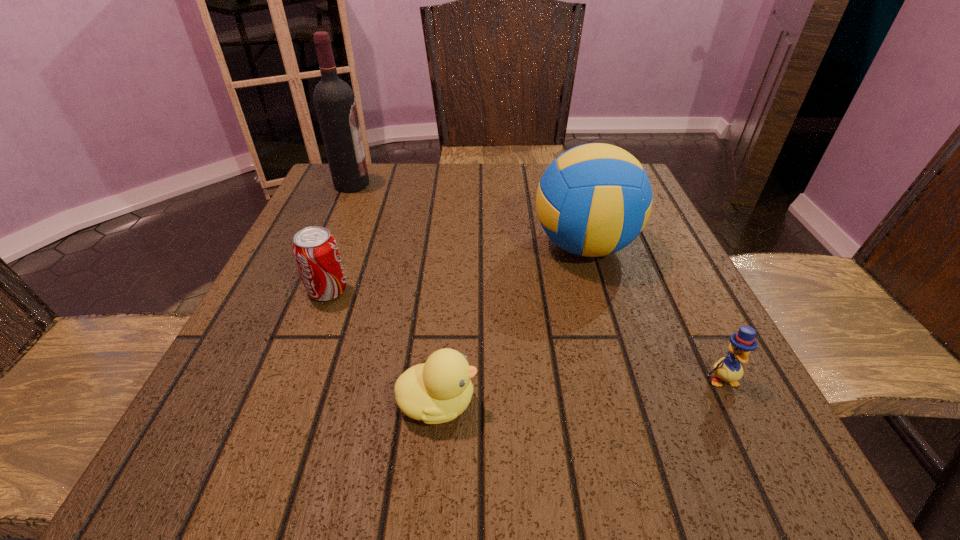
Identify the location of vacant space at the left edge. (303, 227).

You are a GUI agent. You are given a task and a screenshot of the screen. Output one action in this format:
    pyautogui.click(x=<x>, y=<y>)
    Task: Click on the vacant area at the far left corner
    The width and height of the screenshot is (960, 540).
    Given the screenshot: What is the action you would take?
    pyautogui.click(x=321, y=188)

Identify the location of vacant space at the near left corner. The image size is (960, 540). (226, 443).

The height and width of the screenshot is (540, 960). I want to click on free region at the near right corner, so click(681, 446).

At what (x,y) coordinates should I click in order to perform the action: click on free point between the left duckling and the right duckling. Please return your answer as a coordinate pair (x, y). Looking at the image, I should click on 580,391.

Where is `free space that is in between the fourth shortest object and the right duckling`? This screenshot has height=540, width=960. free space that is in between the fourth shortest object and the right duckling is located at coordinates (653, 313).

Locate an element on the screen. This screenshot has height=540, width=960. free space between the third object from left to right and the rightmost object is located at coordinates (580, 391).

The image size is (960, 540). Identify the location of free space between the right duckling and the second object from right to left. (653, 313).

The image size is (960, 540). I want to click on blank region between the left duckling and the rightmost object, so click(580, 391).

The width and height of the screenshot is (960, 540). I want to click on unoccupied area between the fourth object from left to right and the soda, so click(x=456, y=268).